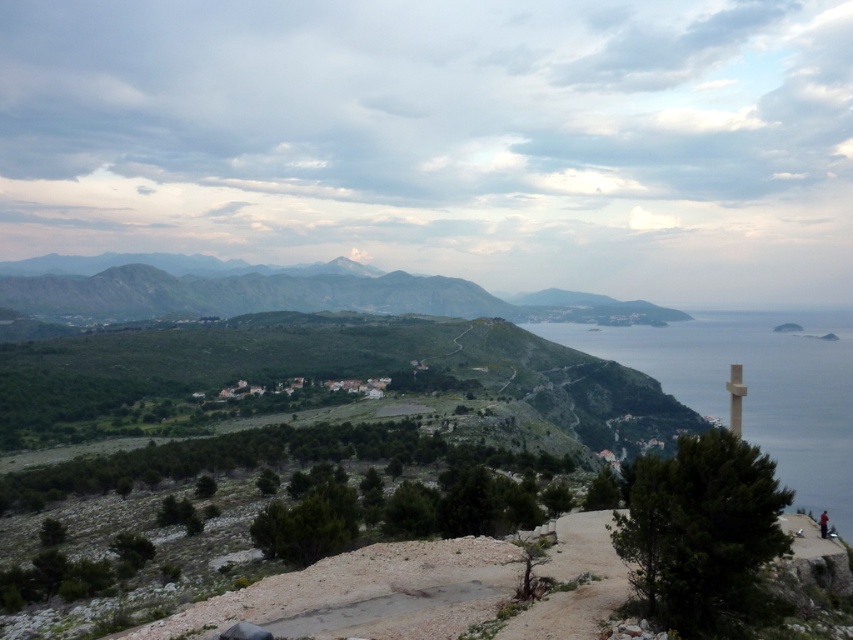
Looking at this image, you are standing at the edge of the stone path leading to the cross structure. You notice the blue water at right and the dark red fabric at lower right. Which object appears taller from your viewpoint?

The blue water at right appears taller than the dark red fabric at lower right because the description states that the blue water at right has a greater height compared to dark red fabric at lower right.

You are a hiker who wants to take a photo of the dark red fabric at lower right and the green grassy hill at left. Which object should you focus on first if you want to capture both in a single frame without moving the camera?

You should focus on the green grassy hill at left first because it is larger and will require more attention in the frame to ensure both objects are captured clearly.

You are standing at the center of the image. From your perspective, which object is closer to the horizon, the blue water at right or the green grassy hill at left?

The blue water at right is shorter than the green grassy hill at left, meaning the blue water at right is closer to the horizon than the green grassy hill at left.